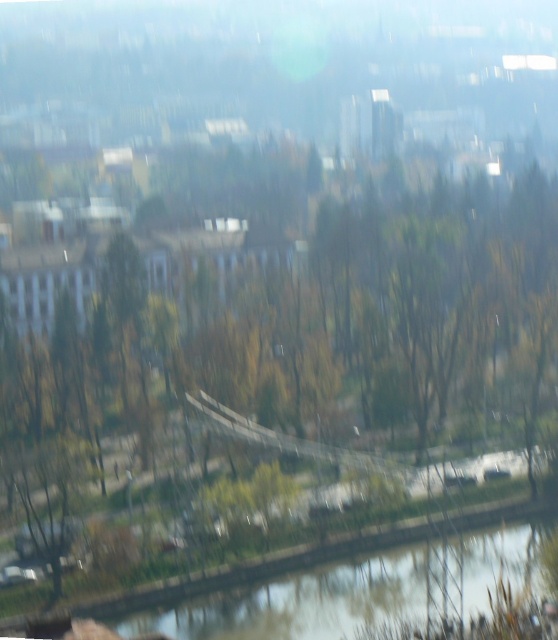
You are standing at a high vantage point overlooking a city and park. You notice two points marked in the scene. Which point, point (170, 416) or point (388, 554), is closer to you?

Point (170, 416) is closer to you because it is further to the viewer than point (388, 554).

You are a photographer trying to capture the scene. You want to ensure that both the brown leafy tree at center and the green grassy river at bottom are clearly visible in your photo. Given the current blurriness of the image, which object might be harder to focus on due to its size?

The brown leafy tree at center is bigger than the green grassy river at bottom, so it might be harder to focus on due to its larger size in the frame.